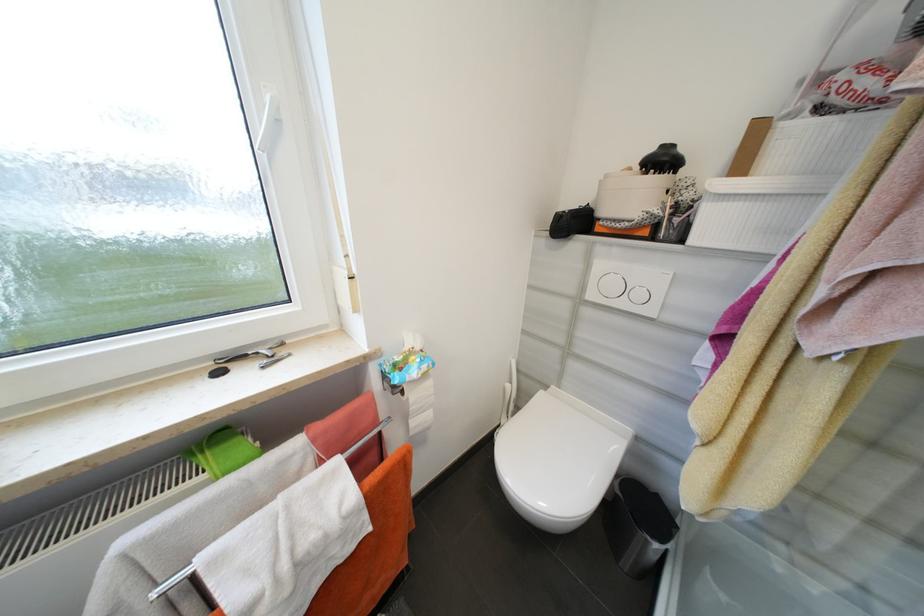
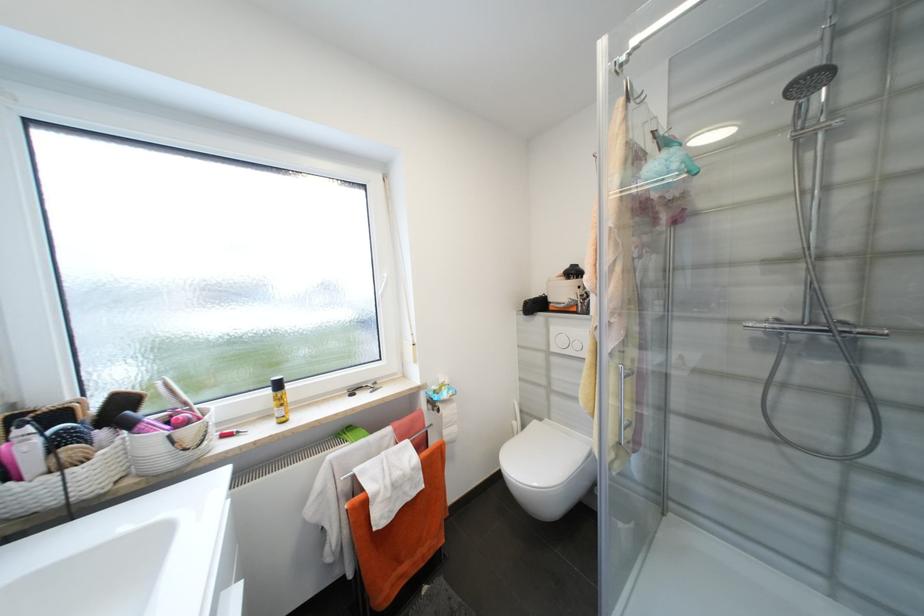
Where in the second image is the point corresponding to (x=407, y=392) from the first image?

(444, 411)